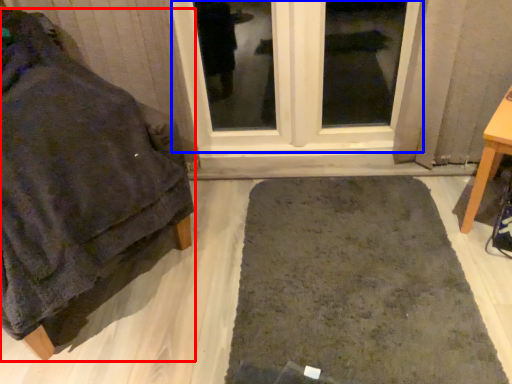
Question: Which object appears closest to the camera in this image, furniture (highlighted by a red box) or window (highlighted by a blue box)?

Choices:
 (A) furniture
 (B) window

Answer: (A)